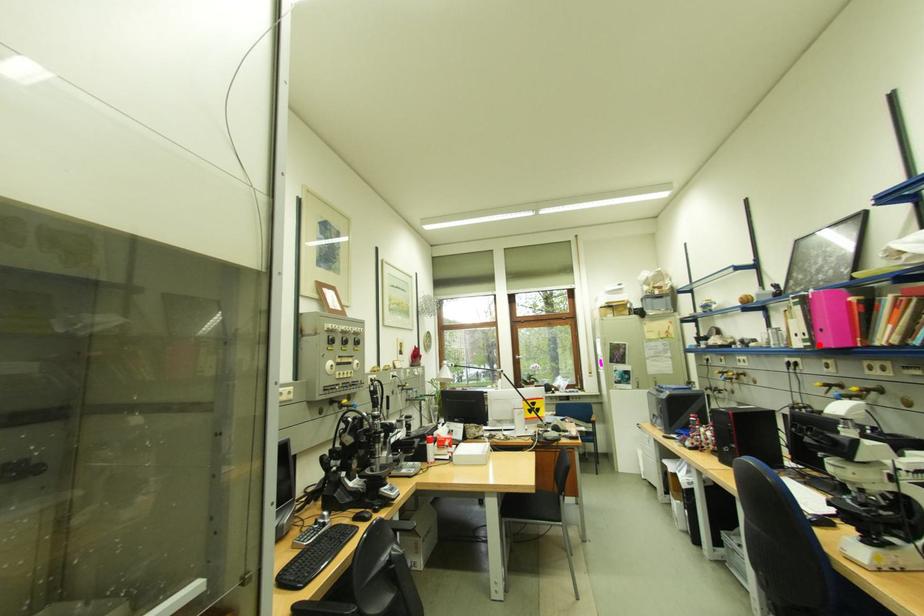
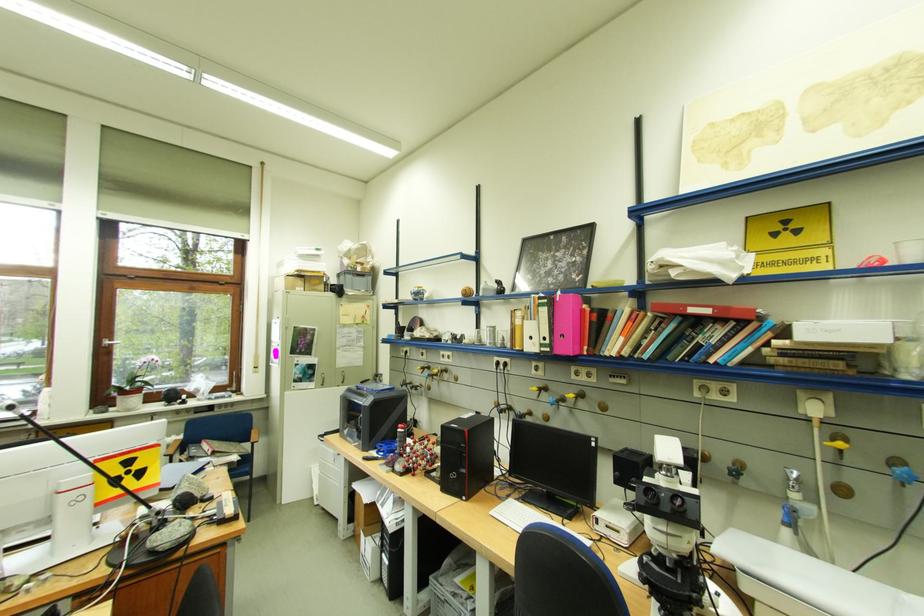
Find the pixel in the second image that matches the highlighted location in the first image.

(558, 351)